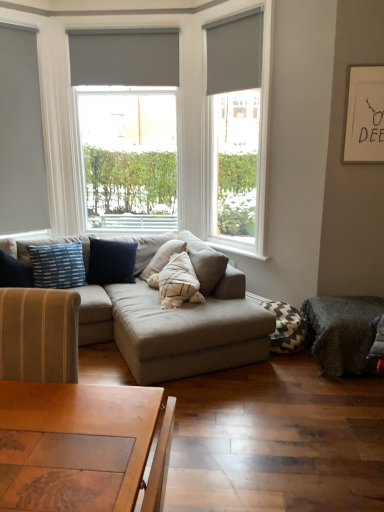
Question: Is matte gray blind at upper right, the 2th blind from the back, turned away from chevron-patterned fabric pillow at lower right, the second pillow in the top-to-bottom sequence?

Choices:
 (A) yes
 (B) no

Answer: (B)

Question: Is matte gray blind at upper right, placed as the first blind when sorted from front to back, oriented towards chevron-patterned fabric pillow at lower right, marked as the first pillow in a bottom-to-top arrangement?

Choices:
 (A) yes
 (B) no

Answer: (B)

Question: Is matte gray blind at upper right, acting as the 1th blind starting from the right, bigger than chevron-patterned fabric pillow at lower right, marked as the first pillow in a bottom-to-top arrangement?

Choices:
 (A) no
 (B) yes

Answer: (A)

Question: Is matte gray blind at upper right, acting as the second blind starting from the left, closer to camera compared to chevron-patterned fabric pillow at lower right, the second pillow in the top-to-bottom sequence?

Choices:
 (A) yes
 (B) no

Answer: (B)

Question: Does matte gray blind at upper right, acting as the 1th blind starting from the right, lie behind chevron-patterned fabric pillow at lower right, the second pillow in the left-to-right sequence?

Choices:
 (A) no
 (B) yes

Answer: (B)

Question: From a real-world perspective, relative to blue striped pillow at left, placed as the 1th pillow when sorted from left to right, is matte gray roller shade at upper right, which ranks as the 3th window in left-to-right order, vertically above or below?

Choices:
 (A) above
 (B) below

Answer: (A)

Question: Relative to blue striped pillow at left, which ranks as the 1th pillow in top-to-bottom order, is matte gray roller shade at upper right, which ranks as the 3th window in left-to-right order, in front or behind?

Choices:
 (A) behind
 (B) front

Answer: (B)

Question: Based on their positions, is matte gray roller shade at upper right, placed as the first window when sorted from right to left, located to the left or right of blue striped pillow at left, which is the 2th pillow from right to left?

Choices:
 (A) right
 (B) left

Answer: (A)

Question: From the image's perspective, is matte gray roller shade at upper right, which ranks as the 3th window in left-to-right order, positioned above or below blue striped pillow at left, which is the 2th pillow from right to left?

Choices:
 (A) above
 (B) below

Answer: (A)

Question: Is white paper at upper right in front of or behind dark gray plush footrest at lower right in the image?

Choices:
 (A) behind
 (B) front

Answer: (A)

Question: Is white paper at upper right taller or shorter than dark gray plush footrest at lower right?

Choices:
 (A) tall
 (B) short

Answer: (A)

Question: Is white paper at upper right spatially inside dark gray plush footrest at lower right, or outside of it?

Choices:
 (A) outside
 (B) inside

Answer: (A)

Question: From the image's perspective, is white paper at upper right positioned above or below dark gray plush footrest at lower right?

Choices:
 (A) above
 (B) below

Answer: (A)

Question: Is matte gray blind at upper center, the 1th blind from the left, wider or thinner than gray matte roller blind at left, placed as the first window when sorted from left to right?

Choices:
 (A) wide
 (B) thin

Answer: (B)

Question: From their relative heights in the image, would you say matte gray blind at upper center, which is the second blind from right to left, is taller or shorter than gray matte roller blind at left, placed as the first window when sorted from left to right?

Choices:
 (A) short
 (B) tall

Answer: (A)